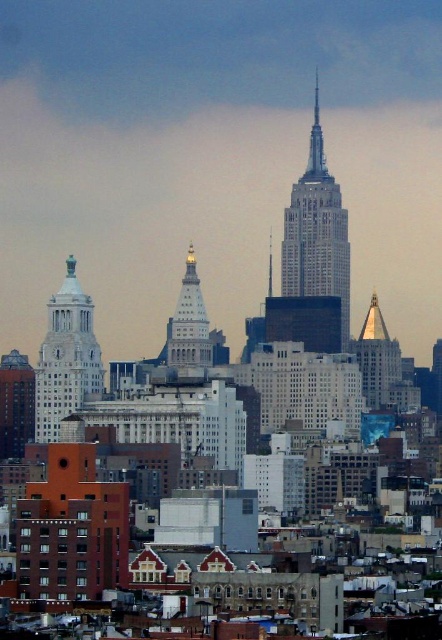
Does gold reflective spire at center have a greater width compared to white marble tower at center?

Indeed, gold reflective spire at center has a greater width compared to white marble tower at center.

Is gold reflective spire at center taller than white marble tower at center?

No, gold reflective spire at center is not taller than white marble tower at center.

Measure the distance between gold reflective spire at center and camera.

gold reflective spire at center is 651.51 meters away from camera.

The image size is (442, 640). In order to click on gold reflective spire at center in this screenshot , I will do `click(377, 358)`.

Between white stone tower at center and white marble tower at center, which one has more height?

white stone tower at center is taller.

Who is more forward, (293, 278) or (186, 262)?

Point (186, 262)

At what (x,y) coordinates should I click in order to perform the action: click on white stone tower at center. Please return your answer as a coordinate pair (x, y). This screenshot has width=442, height=640. Looking at the image, I should click on (316, 232).

Is point (56, 300) closer to camera compared to point (166, 346)?

No.

Is point (75, 332) farther from camera compared to point (179, 291)?

Yes, it is.

Does point (53, 401) come in front of point (168, 330)?

No, it is behind (168, 330).

The height and width of the screenshot is (640, 442). Identify the location of white marble tower at upper left. (67, 358).